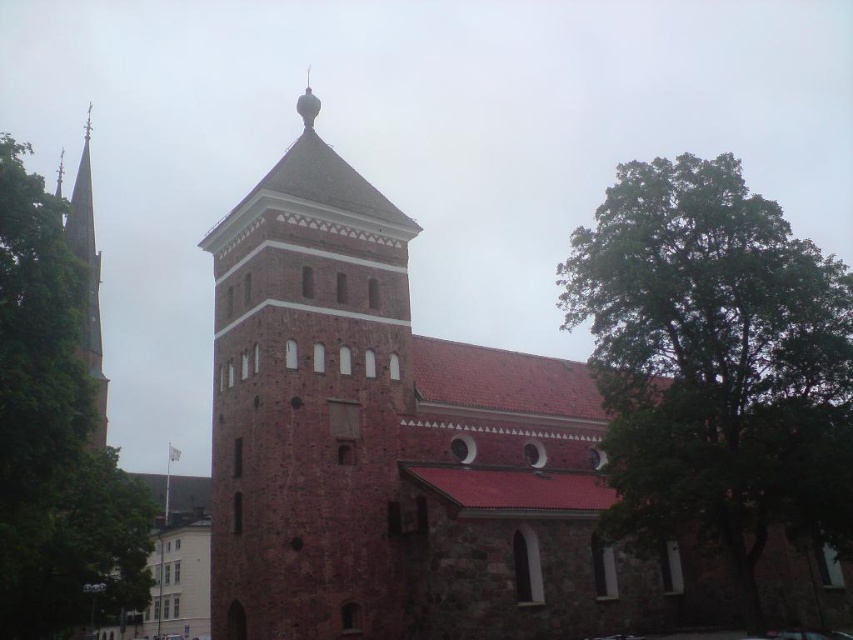
Question: Is green leafy tree at right smaller than smooth brown stone bell tower at left?

Choices:
 (A) yes
 (B) no

Answer: (B)

Question: Which of these objects is positioned closest to the green leafy tree at right?

Choices:
 (A) smooth brown stone bell tower at left
 (B) red brick tower at center

Answer: (B)

Question: Does green leafy tree at left appear over smooth brown stone bell tower at left?

Choices:
 (A) no
 (B) yes

Answer: (B)

Question: Considering the real-world distances, which object is closest to the brown stone church at center?

Choices:
 (A) green leafy tree at right
 (B) smooth brown stone bell tower at left
 (C) red brick tower at center

Answer: (C)

Question: Is brown stone church at center further to camera compared to green leafy tree at right?

Choices:
 (A) yes
 (B) no

Answer: (A)

Question: Among these points, which one is nearest to the camera?

Choices:
 (A) (64, 323)
 (B) (643, 596)

Answer: (A)